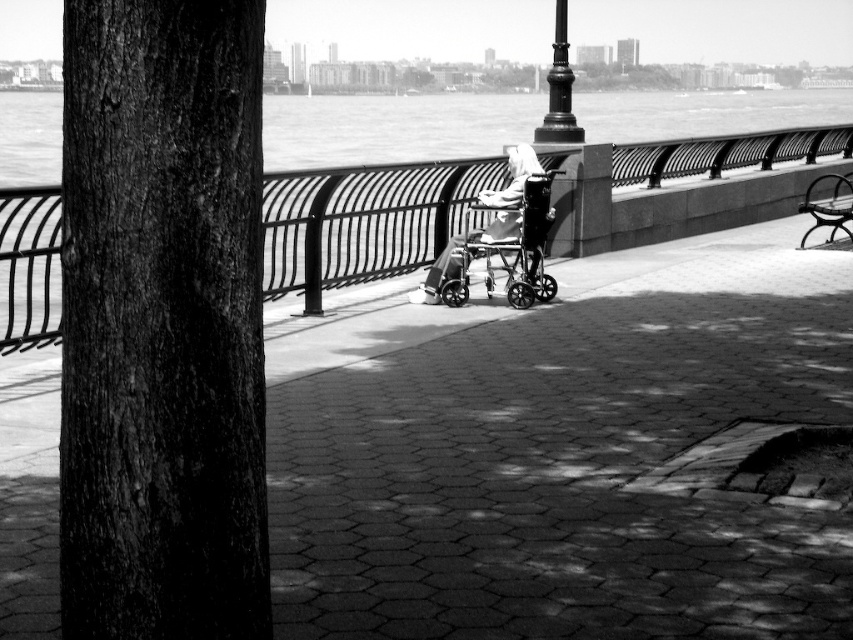
You are a photographer trying to capture a wide shot of the riverside scene. You need to position your tripod between the smooth metal railing at center and the smooth metal bench at right. Since the tripod requires a minimum of 1 meter of space between the two objects to fit, can you determine if there is enough space between them?

The smooth metal railing at center is wider than the smooth metal bench at right, but the description does not provide information about the distance between them. Therefore, it is impossible to determine if there is enough space for the tripod.

You are a photographer standing on the riverside walkway. You want to capture a photo of the brick pavement at center and the dark textured bark at left. Which object is positioned lower in the frame?

The brick pavement at center is located below dark textured bark at left, so it is positioned lower in the frame.